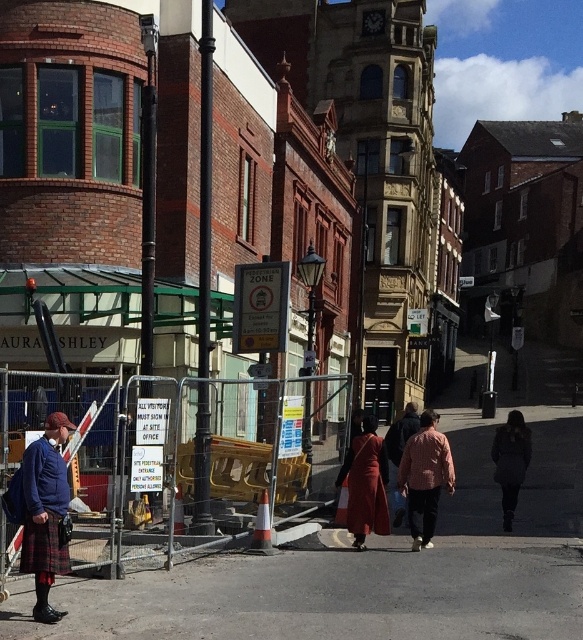
Question: Is tartan fabric kilt at lower left smaller than dark brown leather coat at center?

Choices:
 (A) yes
 (B) no

Answer: (A)

Question: Observing the image, what is the correct spatial positioning of gray asphalt pavement at lower center in reference to matte red dress at center?

Choices:
 (A) below
 (B) above

Answer: (A)

Question: Which object appears closest to the camera in this image?

Choices:
 (A) gray asphalt pavement at lower center
 (B) tartan fabric kilt at lower left
 (C) matte red dress at center

Answer: (B)

Question: Which object is the farthest from the gray asphalt pavement at lower center?

Choices:
 (A) matte red dress at center
 (B) red plaid shirt at center
 (C) tartan fabric kilt at lower left

Answer: (A)

Question: From the image, what is the correct spatial relationship of gray asphalt pavement at lower center in relation to dark brown leather coat at center?

Choices:
 (A) right
 (B) left

Answer: (B)

Question: Which of these objects is positioned farthest from the red plaid shirt at center?

Choices:
 (A) gray asphalt pavement at lower center
 (B) concrete pavement at center
 (C) matte red dress at center

Answer: (B)